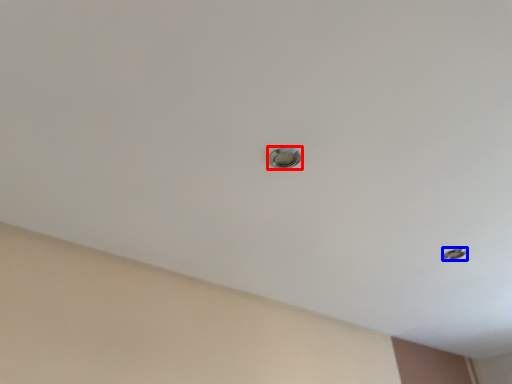
Question: Which object appears farthest to the camera in this image, door handle (highlighted by a red box) or hole (highlighted by a blue box)?

Choices:
 (A) door handle
 (B) hole

Answer: (B)